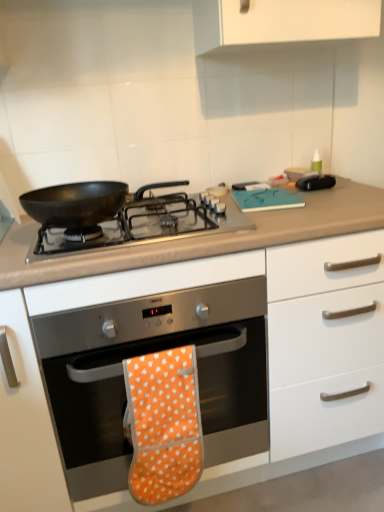
Question: Considering the positions of point (142, 297) and point (134, 384), is point (142, 297) closer or farther from the camera than point (134, 384)?

Choices:
 (A) closer
 (B) farther

Answer: (A)

Question: Is orange fabric oven mitt at center inside or outside of orange fabric oven mitt at center?

Choices:
 (A) inside
 (B) outside

Answer: (B)

Question: Which object is positioned closest to the orange fabric oven mitt at center?

Choices:
 (A) orange fabric oven mitt at center
 (B) white matte cabinet at center
 (C) matte black pan at center
 (D) black matte pan at center

Answer: (A)

Question: Based on their relative distances, which object is farther from the black matte pan at center?

Choices:
 (A) orange fabric oven mitt at center
 (B) matte black pan at center
 (C) orange fabric oven mitt at center
 (D) white matte cabinet at center

Answer: (A)